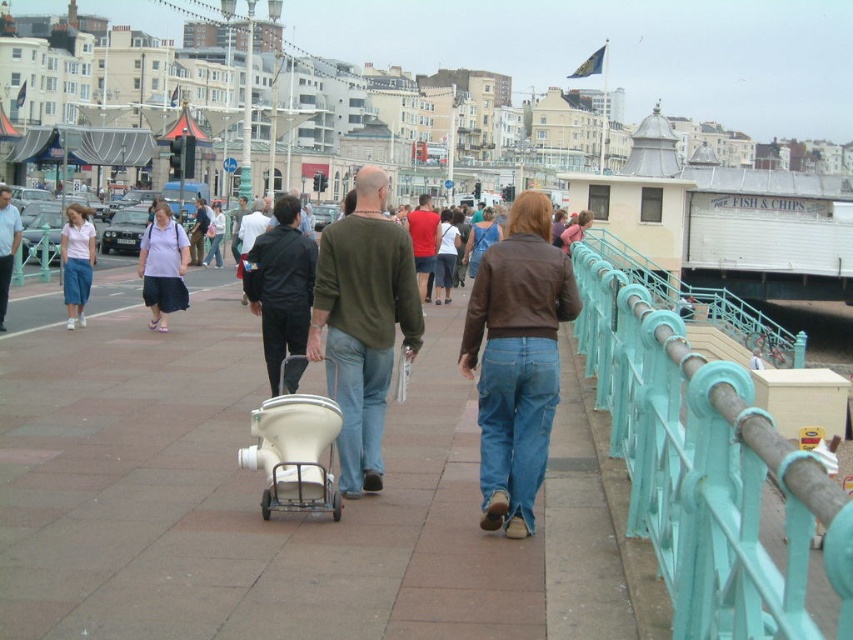
You are a photographer standing on the seaside promenade. You see the matte white skirt at left and the matte black shirt at center. Which one is positioned closer to the right side of the scene?

The matte white skirt at left is to the right of the matte black shirt at center, so the matte white skirt at left is positioned closer to the right side of the scene.

You are standing on the seaside promenade and see the brown leather jacket at center and the matte green sweater at center. Which one is positioned more to the right side of the scene?

The brown leather jacket at center is positioned more to the right side of the scene compared to the matte green sweater at center.